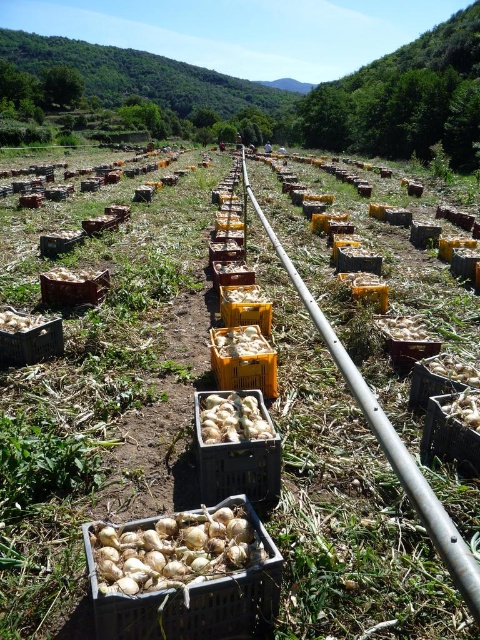
Who is positioned more to the left, matte plastic basket at center or brown woven basket at lower right?

From the viewer's perspective, matte plastic basket at center appears more on the left side.

Can you confirm if matte plastic basket at center is positioned to the right of brown woven basket at lower right?

No, matte plastic basket at center is not to the right of brown woven basket at lower right.

At what (x,y) coordinates should I click in order to perform the action: click on matte plastic basket at center. Please return your answer as a coordinate pair (x, y). Image resolution: width=480 pixels, height=640 pixels. Looking at the image, I should click on (192, 598).

From the picture: Between matte plastic basket at center and black plastic crate at lower right, which one appears on the right side from the viewer's perspective?

black plastic crate at lower right is more to the right.

Between matte plastic basket at center and black plastic crate at lower right, which one appears on the left side from the viewer's perspective?

matte plastic basket at center is more to the left.

At what (x,y) coordinates should I click in order to perform the action: click on matte plastic basket at center. Please return your answer as a coordinate pair (x, y). The width and height of the screenshot is (480, 640). Looking at the image, I should click on (192, 598).

Locate an element on the screen. This screenshot has height=640, width=480. matte plastic basket at center is located at coordinates (192, 598).

Is brown woven basket at lower right bigger than brown plastic basket at lower left?

Actually, brown woven basket at lower right might be smaller than brown plastic basket at lower left.

Can you confirm if brown woven basket at lower right is positioned below brown plastic basket at lower left?

Indeed, brown woven basket at lower right is positioned under brown plastic basket at lower left.

Which is behind, point (469, 364) or point (39, 285)?

The point (39, 285) is more distant.

Locate an element on the screen. The height and width of the screenshot is (640, 480). brown woven basket at lower right is located at coordinates (440, 378).